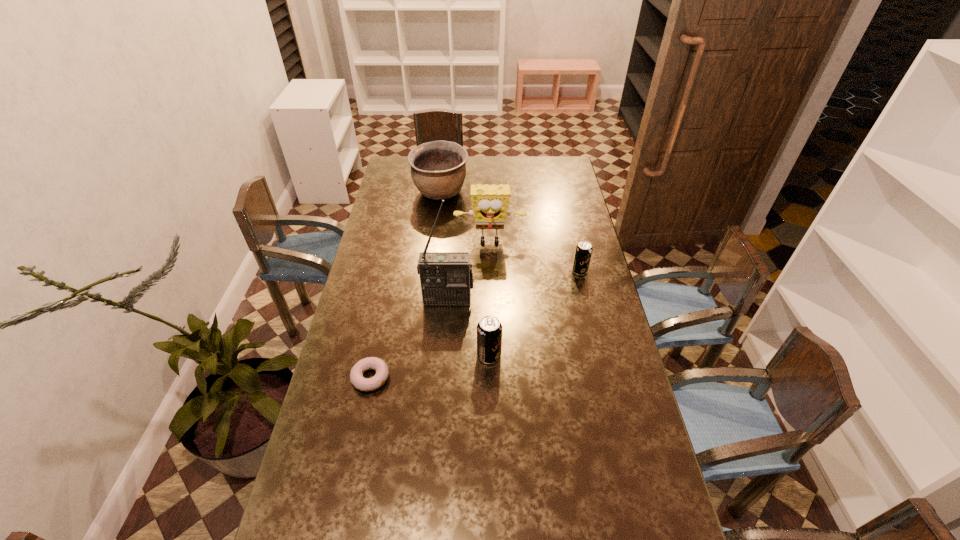
Find the location of `blank area in the image that satisfies the following two spatial constraints: 1. on the back side of the rightmost object; 2. on the right side of the left soda can`. blank area in the image that satisfies the following two spatial constraints: 1. on the back side of the rightmost object; 2. on the right side of the left soda can is located at coordinates (488, 271).

Where is `blank area in the image that satisfies the following two spatial constraints: 1. on the back side of the pottery; 2. on the right side of the doughnut`? This screenshot has width=960, height=540. blank area in the image that satisfies the following two spatial constraints: 1. on the back side of the pottery; 2. on the right side of the doughnut is located at coordinates (409, 193).